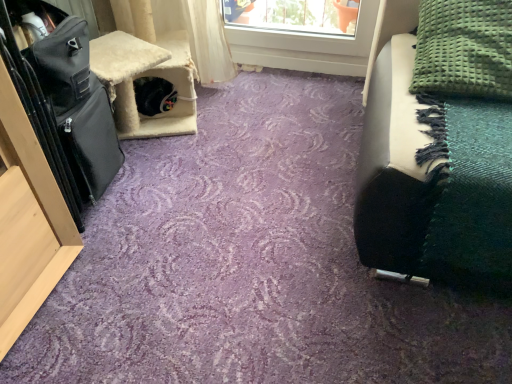
Question: From the image's perspective, is green textured blanket at upper right above or below black leather suitcase at left?

Choices:
 (A) below
 (B) above

Answer: (B)

Question: Considering the relative positions of green textured blanket at upper right and black leather suitcase at left in the image provided, is green textured blanket at upper right to the left or to the right of black leather suitcase at left?

Choices:
 (A) left
 (B) right

Answer: (B)

Question: Considering the positions of point (490, 51) and point (60, 100), is point (490, 51) closer or farther from the camera than point (60, 100)?

Choices:
 (A) farther
 (B) closer

Answer: (B)

Question: Is black leather suitcase at left taller or shorter than green textured blanket at upper right?

Choices:
 (A) short
 (B) tall

Answer: (B)

Question: Looking at the image, does black leather suitcase at left seem bigger or smaller compared to green textured blanket at upper right?

Choices:
 (A) big
 (B) small

Answer: (A)

Question: In terms of width, does black leather suitcase at left look wider or thinner when compared to green textured blanket at upper right?

Choices:
 (A) thin
 (B) wide

Answer: (B)

Question: Choose the correct answer: Is black leather suitcase at left inside green textured blanket at upper right or outside it?

Choices:
 (A) outside
 (B) inside

Answer: (A)